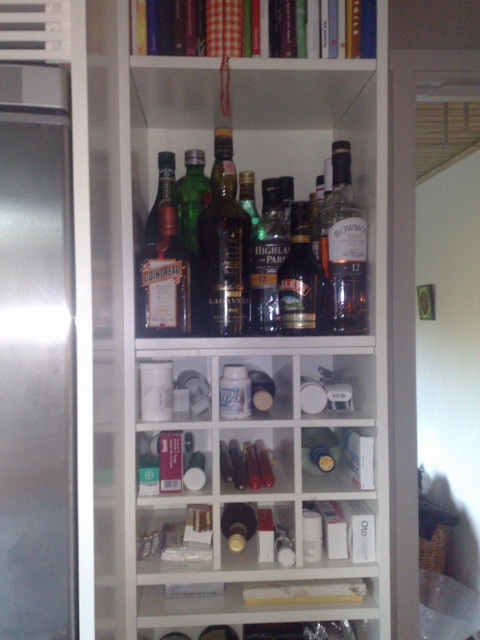
Does shiny dark green bottle at center have a greater height compared to translucent glass bottle at center?

Yes, shiny dark green bottle at center is taller than translucent glass bottle at center.

Can you confirm if shiny dark green bottle at center is positioned below translucent glass bottle at center?

Incorrect, shiny dark green bottle at center is not positioned below translucent glass bottle at center.

In order to click on shiny dark green bottle at center in this screenshot , I will do `click(223, 248)`.

What do you see at coordinates (165, 282) in the screenshot? I see `matte glass bottle at center-left` at bounding box center [165, 282].

Between point (187, 282) and point (304, 244), which one is positioned behind?

Point (304, 244)

Between point (180, 272) and point (294, 326), which one is positioned in front?

Point (180, 272)

At what (x,y) coordinates should I click in order to perform the action: click on matte glass bottle at center-left. Please return your answer as a coordinate pair (x, y). Looking at the image, I should click on (165, 282).

Does satin silver refrigerator at left have a lesser width compared to matte glass bottle at center-left?

Incorrect, satin silver refrigerator at left's width is not less than matte glass bottle at center-left's.

Is satin silver refrigerator at left smaller than matte glass bottle at center-left?

No.

Who is more distant from viewer, (72,99) or (187,276)?

Positioned behind is point (187,276).

Locate an element on the screen. The image size is (480, 640). satin silver refrigerator at left is located at coordinates (74, 241).